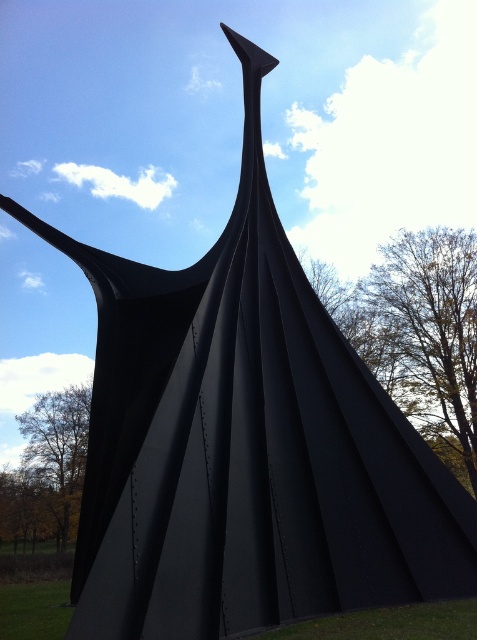
Question: Which of the following is the closest to the observer?

Choices:
 (A) green grass at lower center
 (B) green grass at lower left
 (C) brown leafy tree at lower left

Answer: (A)

Question: Which of the following is the closest to the observer?

Choices:
 (A) (19, 636)
 (B) (447, 433)
 (C) (320, 627)

Answer: (C)

Question: Which point is farther to the camera?

Choices:
 (A) (28, 609)
 (B) (33, 460)
 (C) (377, 288)
 (D) (421, 611)

Answer: (B)

Question: Does green leafy tree at upper right come behind brown leafy tree at lower left?

Choices:
 (A) no
 (B) yes

Answer: (A)

Question: Is brown leafy tree at lower left further to camera compared to green grass at lower center?

Choices:
 (A) yes
 (B) no

Answer: (A)

Question: Is green grass at lower center in front of green grass at lower left?

Choices:
 (A) no
 (B) yes

Answer: (B)